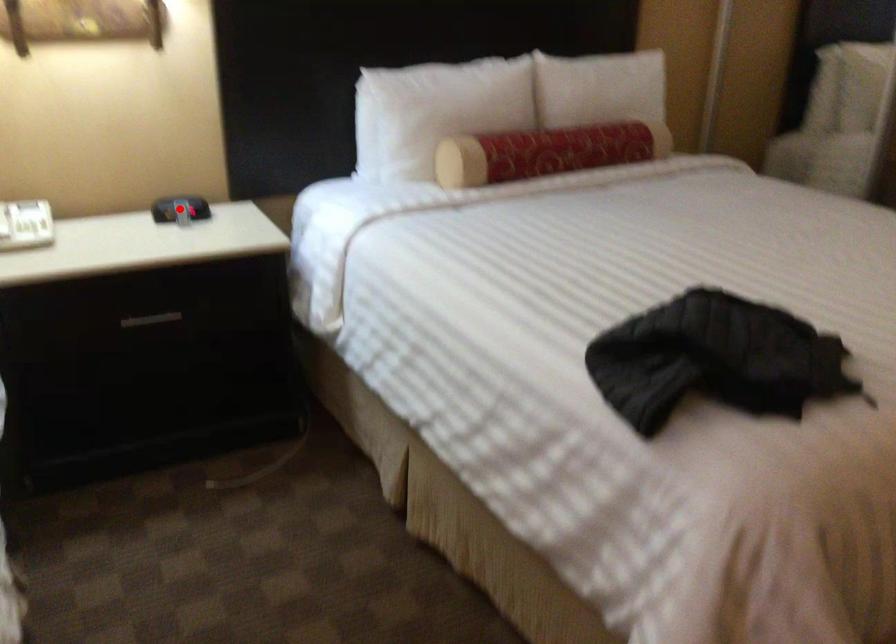
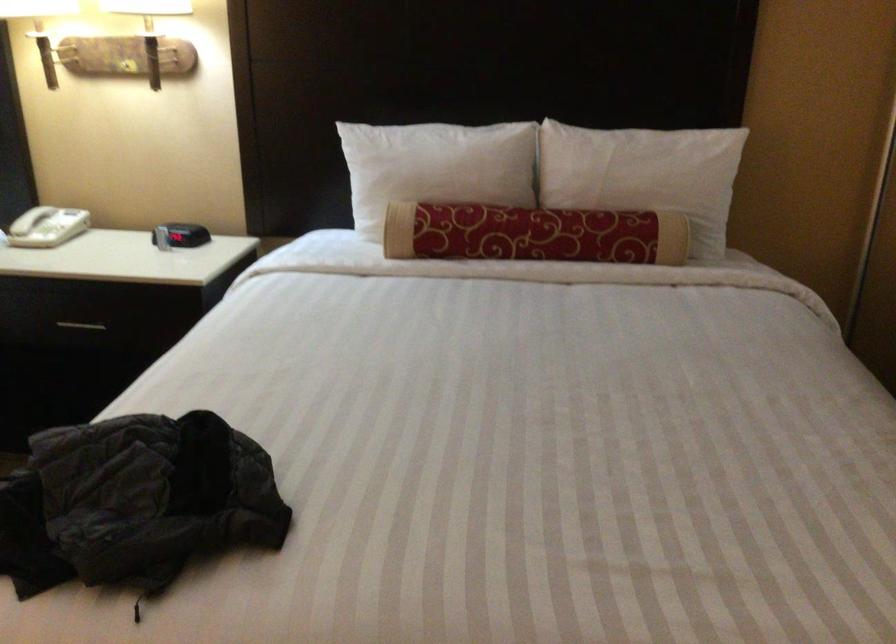
Question: I am providing you with two images of the same scene from different viewpoints. Image1 has a red point marked. In image2, the corresponding 3D location appears at what relative position? Reply with the corresponding letter.

Choices:
 (A) Closer
 (B) Farther

Answer: (B)